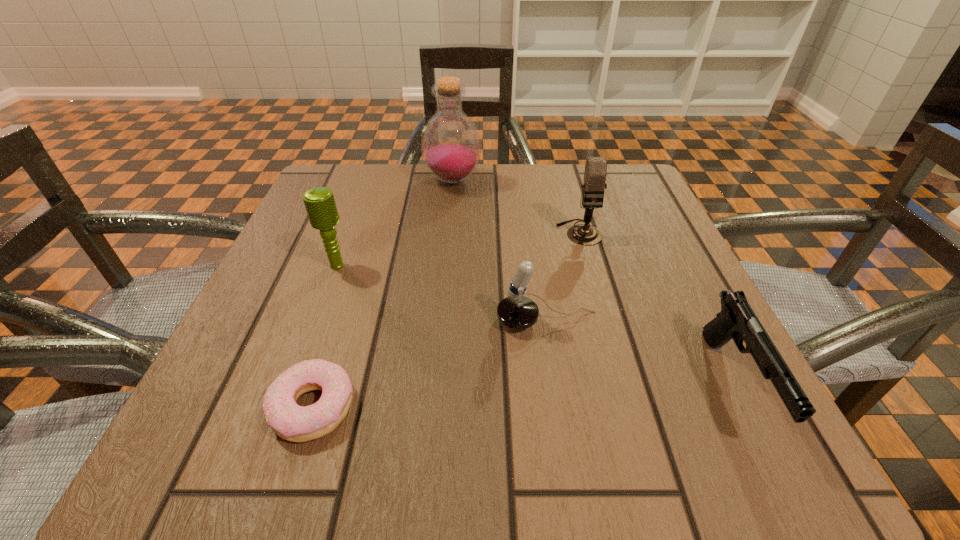
Locate an element on the screen. The width and height of the screenshot is (960, 540). vacant space located 0.300m on the front of the leftmost microphone is located at coordinates (276, 433).

The height and width of the screenshot is (540, 960). What are the coordinates of `vacant space located 0.360m on the left of the shortest microphone` in the screenshot? It's located at (x=268, y=321).

Find the location of a particular element. The width and height of the screenshot is (960, 540). free space located 0.190m on the right of the doughnut is located at coordinates (498, 407).

This screenshot has width=960, height=540. I want to click on bottle that is at the far edge, so click(451, 146).

What are the coordinates of `microphone at the far edge` in the screenshot? It's located at (595, 172).

This screenshot has height=540, width=960. I want to click on gun that is at the near edge, so click(737, 321).

You are a GUI agent. You are given a task and a screenshot of the screen. Output one action in this format:
    pyautogui.click(x=<x>, y=<y>)
    Task: Click on the doughnut located in the near edge section of the desktop
    The height and width of the screenshot is (540, 960).
    Given the screenshot: What is the action you would take?
    pyautogui.click(x=294, y=423)

You are a GUI agent. You are given a task and a screenshot of the screen. Output one action in this format:
    pyautogui.click(x=<x>, y=<y>)
    Task: Click on the microphone located in the left edge section of the desktop
    
    Given the screenshot: What is the action you would take?
    pyautogui.click(x=319, y=202)

Where is `doughnut located in the left edge section of the desktop`? doughnut located in the left edge section of the desktop is located at coordinates (294, 423).

In order to click on microphone that is at the right edge in this screenshot , I will do `click(595, 172)`.